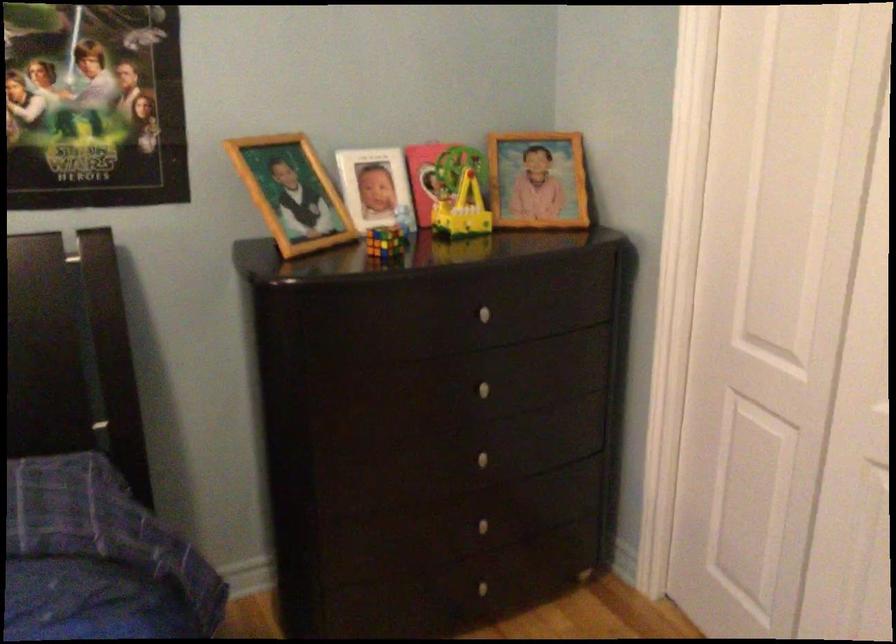
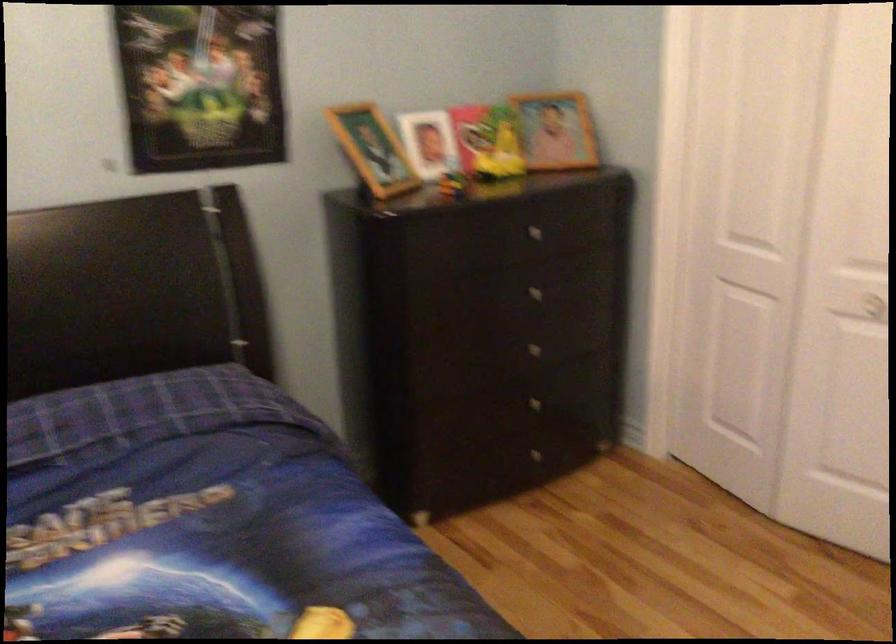
The point at (470, 527) is marked in the first image. Where is the corresponding point in the second image?

(528, 406)